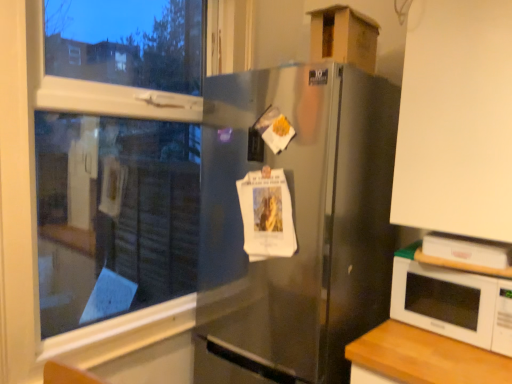
What do you see at coordinates (297, 222) in the screenshot?
I see `satin silver refrigerator at center` at bounding box center [297, 222].

The image size is (512, 384). Identify the location of satin silver refrigerator at center. (297, 222).

There is a satin silver refrigerator at center. Where is `cardboard box above it (from a real-world perspective)`? The height and width of the screenshot is (384, 512). cardboard box above it (from a real-world perspective) is located at coordinates point(344,37).

Measure the distance from satin silver refrigerator at center to cardboard box at upper right.

satin silver refrigerator at center and cardboard box at upper right are 20.50 inches apart.

Is satin silver refrigerator at center in contact with cardboard box at upper right?

There is a gap between satin silver refrigerator at center and cardboard box at upper right.

From the image's perspective, which object appears higher, satin silver refrigerator at center or cardboard box at upper right?

cardboard box at upper right, from the image's perspective.

Is satin silver refrigerator at center a part of transparent glass window at upper left?

No, satin silver refrigerator at center is not a part of transparent glass window at upper left.

Considering the positions of objects transparent glass window at upper left and satin silver refrigerator at center in the image provided, who is more to the left, transparent glass window at upper left or satin silver refrigerator at center?

Positioned to the left is transparent glass window at upper left.

Is point (133, 171) more distant than point (319, 340)?

That is True.

Considering the relative sizes of transparent glass window at upper left and satin silver refrigerator at center in the image provided, is transparent glass window at upper left smaller than satin silver refrigerator at center?

Indeed, transparent glass window at upper left has a smaller size compared to satin silver refrigerator at center.

Is the surface of white glossy microwave at lower right in direct contact with white matte cabinet at upper right?

No, white glossy microwave at lower right is not next to white matte cabinet at upper right.

Which of these two, white glossy microwave at lower right or white matte cabinet at upper right, stands taller?

white matte cabinet at upper right.

From the image's perspective, does white glossy microwave at lower right appear lower than white matte cabinet at upper right?

Yes, from the image's perspective, white glossy microwave at lower right is below white matte cabinet at upper right.

Consider the image. In terms of width, does white glossy microwave at lower right look wider or thinner when compared to white matte cabinet at upper right?

Considering their sizes, white glossy microwave at lower right looks slimmer than white matte cabinet at upper right.

Is white glossy microwave at lower right shorter than transparent glass window at upper left?

Yes.

Considering the relative positions of white glossy microwave at lower right and transparent glass window at upper left in the image provided, is white glossy microwave at lower right to the right of transparent glass window at upper left from the viewer's perspective?

Yes.

Which object is closer to the camera, white glossy microwave at lower right or transparent glass window at upper left?

transparent glass window at upper left is more forward.

Is satin silver refrigerator at center further to camera compared to white glossy microwave at lower right?

No, it is in front of white glossy microwave at lower right.

Considering the points (382, 106) and (442, 324), which point is behind, point (382, 106) or point (442, 324)?

The point (382, 106) is farther.

Is satin silver refrigerator at center aimed at white glossy microwave at lower right?

No, satin silver refrigerator at center is not facing towards white glossy microwave at lower right.

Between satin silver refrigerator at center and white glossy microwave at lower right, which one appears on the right side from the viewer's perspective?

white glossy microwave at lower right.

Choose the correct answer: Is white matte cabinet at upper right inside satin silver refrigerator at center or outside it?

white matte cabinet at upper right is not enclosed by satin silver refrigerator at center.

Does white matte cabinet at upper right come behind satin silver refrigerator at center?

No, the depth of white matte cabinet at upper right is less than that of satin silver refrigerator at center.

Would you say white matte cabinet at upper right is to the left or to the right of satin silver refrigerator at center in the picture?

From the image, it's evident that white matte cabinet at upper right is to the right of satin silver refrigerator at center.

Based on the photo, is white matte cabinet at upper right positioned with its back to satin silver refrigerator at center?

white matte cabinet at upper right does not have its back to satin silver refrigerator at center.

In the image, is transparent glass window at upper left positioned in front of or behind white glossy microwave at lower right?

transparent glass window at upper left is positioned closer to the viewer than white glossy microwave at lower right.

You are a GUI agent. You are given a task and a screenshot of the screen. Output one action in this format:
    pyautogui.click(x=<x>, y=<y>)
    Task: Click on the microwave oven below the transparent glass window at upper left (from a real-world perspective)
    Image resolution: width=512 pixels, height=384 pixels.
    Given the screenshot: What is the action you would take?
    pyautogui.click(x=452, y=303)

Which is behind, point (97, 168) or point (432, 319)?

The point (97, 168) is farther.

From a real-world perspective, which is physically below, transparent glass window at upper left or white glossy microwave at lower right?

From a 3D spatial view, white glossy microwave at lower right is below.

Identify the location of refrigerator that is below the cardboard box at upper right (from the image's perspective). Image resolution: width=512 pixels, height=384 pixels. (297, 222).

I want to click on refrigerator directly beneath the transparent glass window at upper left (from a real-world perspective), so click(x=297, y=222).

Which object lies further to the anchor point white matte cabinet at upper right, cardboard box at upper right or satin silver refrigerator at center?

cardboard box at upper right lies further to white matte cabinet at upper right than the other object.

Estimate the real-world distances between objects in this image. Which object is closer to cardboard box at upper right, white matte cabinet at upper right or white glossy microwave at lower right?

white matte cabinet at upper right lies closer to cardboard box at upper right than the other object.

When comparing their distances from transparent glass window at upper left, does satin silver refrigerator at center or cardboard box at upper right seem further?

Based on the image, cardboard box at upper right appears to be further to transparent glass window at upper left.

When comparing their distances from white matte cabinet at upper right, does transparent glass window at upper left or cardboard box at upper right seem closer?

cardboard box at upper right is positioned closer to the anchor white matte cabinet at upper right.

Which object lies nearer to the anchor point white glossy microwave at lower right, white matte cabinet at upper right or cardboard box at upper right?

Based on the image, white matte cabinet at upper right appears to be nearer to white glossy microwave at lower right.

Based on their spatial positions, is satin silver refrigerator at center or transparent glass window at upper left further from white glossy microwave at lower right?

transparent glass window at upper left lies further to white glossy microwave at lower right than the other object.

Considering their positions, is white glossy microwave at lower right positioned closer to transparent glass window at upper left than satin silver refrigerator at center?

satin silver refrigerator at center.

Based on their spatial positions, is white matte cabinet at upper right or cardboard box at upper right further from satin silver refrigerator at center?

cardboard box at upper right is further to satin silver refrigerator at center.

Find the location of a particular element. The height and width of the screenshot is (384, 512). cabinetry that lies between cardboard box at upper right and white glossy microwave at lower right from top to bottom is located at coordinates (456, 120).

Where is `refrigerator between cardboard box at upper right and white glossy microwave at lower right in the up-down direction`? The width and height of the screenshot is (512, 384). refrigerator between cardboard box at upper right and white glossy microwave at lower right in the up-down direction is located at coordinates pos(297,222).

Locate an element on the screen. cardboard box located between transparent glass window at upper left and white glossy microwave at lower right in the left-right direction is located at coordinates (344, 37).

Where is `microwave oven located between satin silver refrigerator at center and white matte cabinet at upper right in the left-right direction`? microwave oven located between satin silver refrigerator at center and white matte cabinet at upper right in the left-right direction is located at coordinates (452, 303).